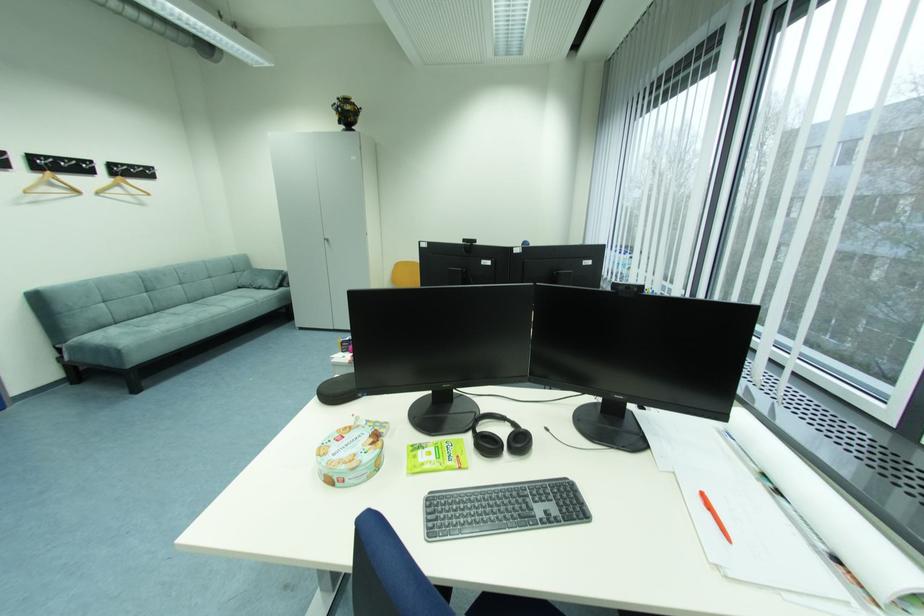
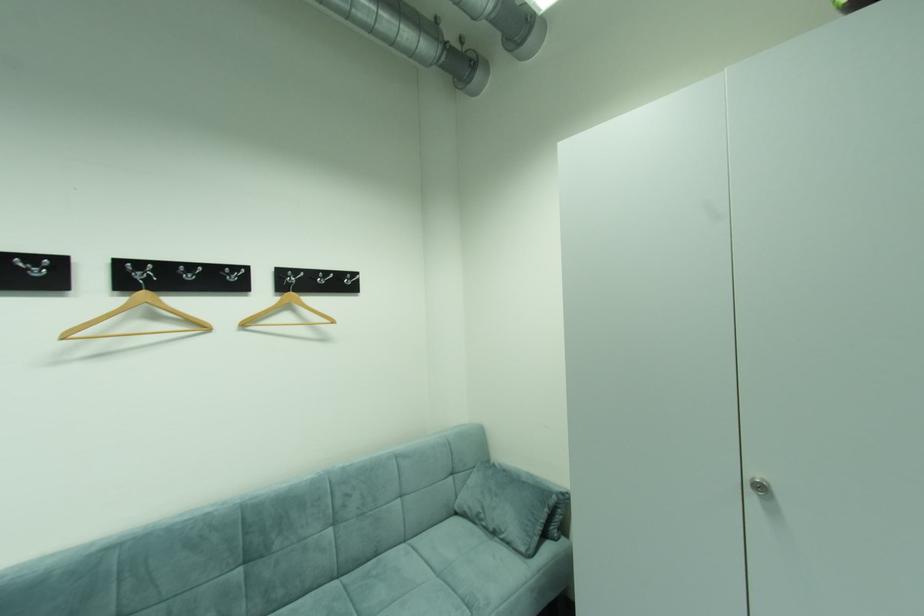
Locate, in the second image, the point that corresponds to point (104, 193) in the first image.

(251, 326)